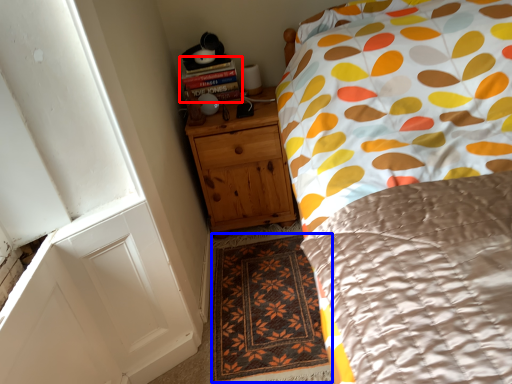
Question: Among these objects, which one is nearest to the camera, book (highlighted by a red box) or doormat (highlighted by a blue box)?

Choices:
 (A) book
 (B) doormat

Answer: (B)